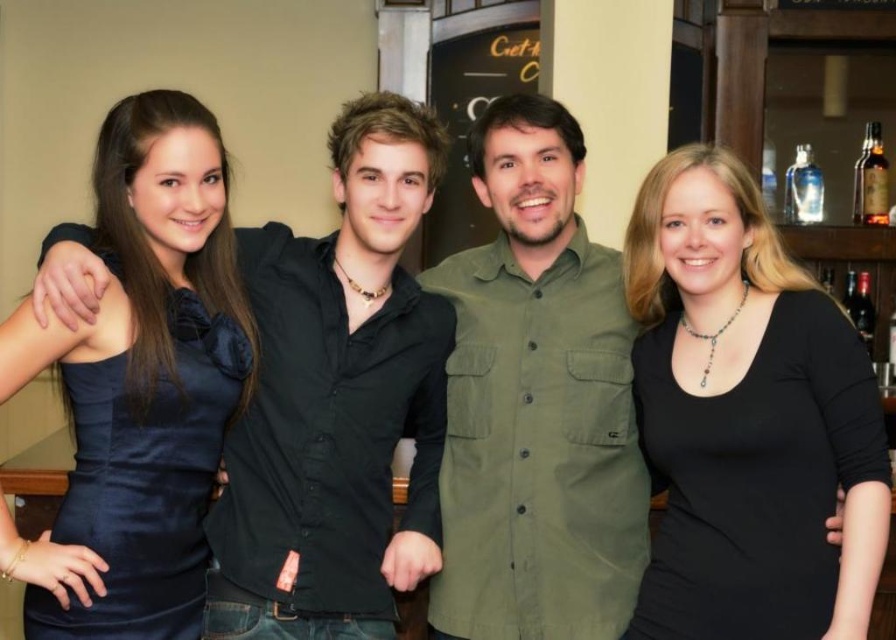
Can you confirm if black matte shirt at center is positioned above satin blue dress at left?

Actually, black matte shirt at center is below satin blue dress at left.

Locate an element on the screen. black matte shirt at center is located at coordinates (746, 419).

From the picture: Which is more to the left, black matte shirt at center or green matte shirt at center?

From the viewer's perspective, green matte shirt at center appears more on the left side.

Image resolution: width=896 pixels, height=640 pixels. I want to click on black matte shirt at center, so click(x=746, y=419).

Is black matte shirt at center smaller than brown glass bottle at upper right?

No, black matte shirt at center is not smaller than brown glass bottle at upper right.

Can you confirm if black matte shirt at center is wider than brown glass bottle at upper right?

Yes, black matte shirt at center is wider than brown glass bottle at upper right.

Locate an element on the screen. The height and width of the screenshot is (640, 896). black matte shirt at center is located at coordinates (746, 419).